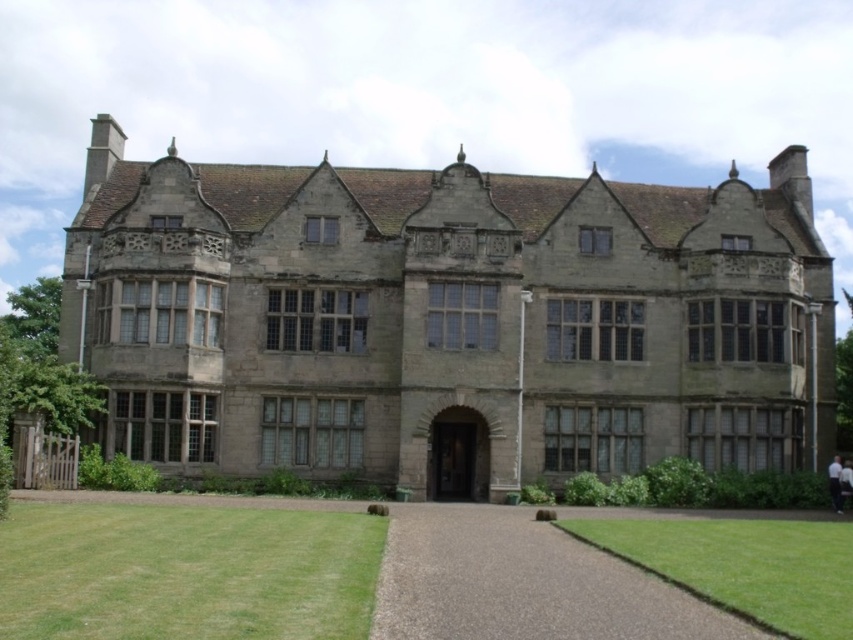
You are a gardener planning to install a new flower bed between the brown gravel driveway at center and the green grass at lower right. The flower bed requires a minimum of 5 meters of space between the two areas. Can you proceed with the installation?

The brown gravel driveway at center and green grass at lower right are 7.41 meters apart from each other, which is more than the required 5 meters. Therefore, you can proceed with installing the flower bed between them.

You are a gardener planning to mow the green grass at lower right and the brown gravel driveway at center. Which area requires mowing first based on their positions?

The green grass at lower right requires mowing first because it is positioned further away from the entrance compared to the brown gravel driveway at center, which is closer.